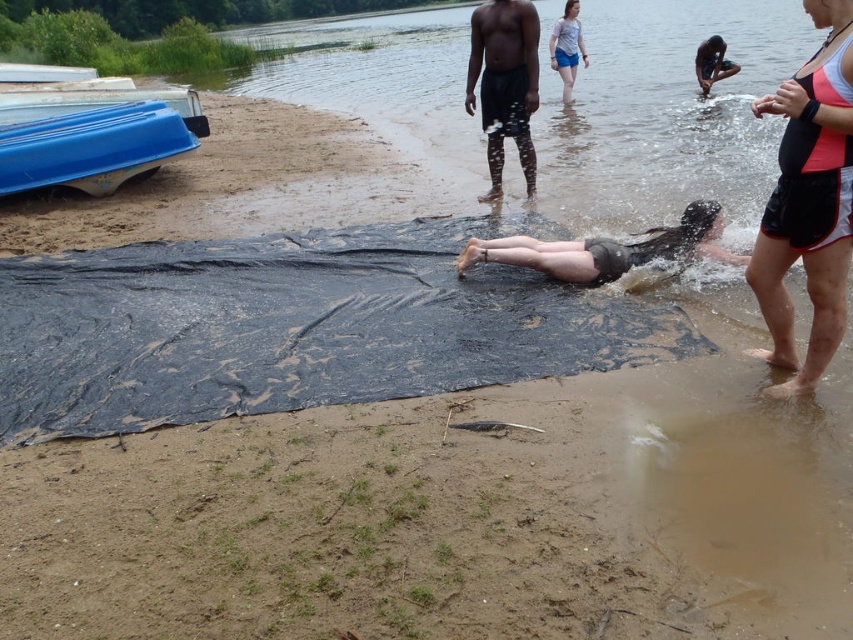
Can you confirm if black matte shorts at lower right is positioned to the right of blue plastic boat at left?

Correct, you'll find black matte shorts at lower right to the right of blue plastic boat at left.

Between point (811, 358) and point (33, 172), which one is positioned in front?

Positioned in front is point (811, 358).

Between point (844, 266) and point (16, 161), which one is positioned behind?

Positioned behind is point (16, 161).

Where is `black matte shorts at lower right`? The image size is (853, 640). black matte shorts at lower right is located at coordinates (809, 200).

Is black matte shorts at lower right positioned in front of dark gray shorts at center?

That is True.

Can you confirm if black matte shorts at lower right is thinner than dark gray shorts at center?

Yes.

Who is more distant from viewer, [831,172] or [717,202]?

Positioned behind is point [717,202].

The height and width of the screenshot is (640, 853). I want to click on black matte shorts at lower right, so click(809, 200).

How far apart are black matte shorts at lower right and dark skin human at upper right?

A distance of 10.48 meters exists between black matte shorts at lower right and dark skin human at upper right.

Is black matte shorts at lower right to the left of dark skin human at upper right from the viewer's perspective?

Yes, black matte shorts at lower right is to the left of dark skin human at upper right.

The width and height of the screenshot is (853, 640). Find the location of `black matte shorts at lower right`. black matte shorts at lower right is located at coordinates (809, 200).